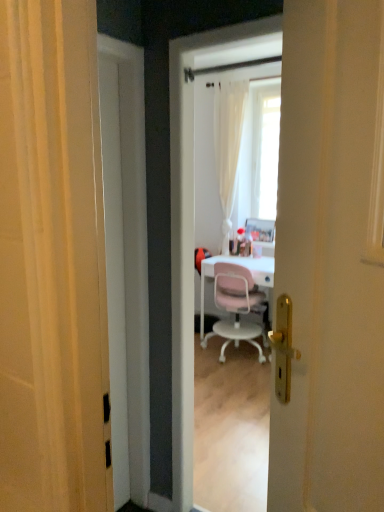
The width and height of the screenshot is (384, 512). What do you see at coordinates (236, 307) in the screenshot?
I see `pink plastic chair at center` at bounding box center [236, 307].

This screenshot has height=512, width=384. Find the location of `white glossy door at center`. white glossy door at center is located at coordinates (115, 273).

Is pink plastic chair at center touching white glossy door at center?

No, pink plastic chair at center is not with white glossy door at center.

Is pink plastic chair at center oriented away from white glossy door at center?

Yes, pink plastic chair at center's orientation is away from white glossy door at center.

Based on their sizes in the image, would you say white glossy screen door at center is bigger or smaller than white glossy door at center?

Considering their sizes, white glossy screen door at center takes up more space than white glossy door at center.

Is white glossy screen door at center wider or thinner than white glossy door at center?

white glossy screen door at center is wider than white glossy door at center.

How far apart are white glossy screen door at center and white glossy door at center?

white glossy screen door at center is 2.45 meters from white glossy door at center.

Is white glossy screen door at center situated inside white glossy door at center or outside?

white glossy screen door at center lies outside white glossy door at center.

From the image's perspective, is white glossy door at center located above pink plastic chair at center?

Yes, from the image's perspective, white glossy door at center is over pink plastic chair at center.

Between white glossy door at center and pink plastic chair at center, which one has less height?

pink plastic chair at center.

From a real-world perspective, relative to pink plastic chair at center, is white glossy door at center vertically above or below?

white glossy door at center is above pink plastic chair at center.

Would you say white glossy screen door at center is to the left or to the right of pink plastic chair at center in the picture?

From the image, it's evident that white glossy screen door at center is to the left of pink plastic chair at center.

This screenshot has height=512, width=384. In order to click on screen door on the left of pink plastic chair at center in this screenshot , I will do `click(203, 200)`.

Which object is further away from the camera, white glossy screen door at center or pink plastic chair at center?

pink plastic chair at center is behind.

Consider the image. Considering the sizes of white glossy screen door at center and pink plastic chair at center in the image, is white glossy screen door at center bigger or smaller than pink plastic chair at center?

white glossy screen door at center is smaller than pink plastic chair at center.

Considering the relative sizes of pink plastic chair at center and white glossy screen door at center in the image provided, is pink plastic chair at center taller than white glossy screen door at center?

In fact, pink plastic chair at center may be shorter than white glossy screen door at center.

The width and height of the screenshot is (384, 512). What are the coordinates of `screen door on the left of the pink plastic chair at center` in the screenshot? It's located at [203, 200].

Is pink plastic chair at center completely or partially outside of white glossy screen door at center?

pink plastic chair at center lies outside white glossy screen door at center's area.

Is pink plastic chair at center far from white glossy screen door at center?

They are positioned close to each other.

I want to click on door on the left of white glossy screen door at center, so click(x=115, y=273).

Is white glossy door at center surrounding white glossy screen door at center?

Definitely not — white glossy screen door at center is not inside white glossy door at center.

How different are the orientations of white glossy door at center and white glossy screen door at center in degrees?

90 degrees.

Identify the location of chair below the white glossy door at center (from the image's perspective). (236, 307).

At what (x,y) coordinates should I click in order to perform the action: click on screen door to the right of white glossy door at center. Please return your answer as a coordinate pair (x, y). This screenshot has height=512, width=384. Looking at the image, I should click on (203, 200).

Which object lies nearer to the anchor point pink plastic chair at center, white glossy door at center or white glossy screen door at center?

The object closer to pink plastic chair at center is white glossy screen door at center.

When comparing their distances from white glossy screen door at center, does white glossy door at center or pink plastic chair at center seem closer?

pink plastic chair at center is closer to white glossy screen door at center.

Based on their spatial positions, is pink plastic chair at center or white glossy screen door at center further from white glossy door at center?

Based on the image, white glossy screen door at center appears to be further to white glossy door at center.

Based on their spatial positions, is pink plastic chair at center or white glossy door at center closer to white glossy screen door at center?

Based on the image, pink plastic chair at center appears to be nearer to white glossy screen door at center.

Which object lies further to the anchor point pink plastic chair at center, white glossy screen door at center or white glossy door at center?

The object further to pink plastic chair at center is white glossy door at center.

Considering their positions, is white glossy screen door at center positioned closer to white glossy door at center than pink plastic chair at center?

Based on the image, pink plastic chair at center appears to be nearer to white glossy door at center.

The image size is (384, 512). In order to click on door between white glossy screen door at center and pink plastic chair at center along the z-axis in this screenshot , I will do `click(115, 273)`.